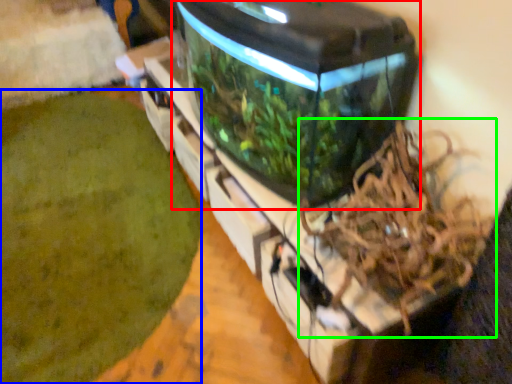
Question: Which object is the farthest from water tank (highlighted by a red box)? Choose among these: debris (highlighted by a blue box) or bird nest (highlighted by a green box).

Choices:
 (A) debris
 (B) bird nest

Answer: (A)